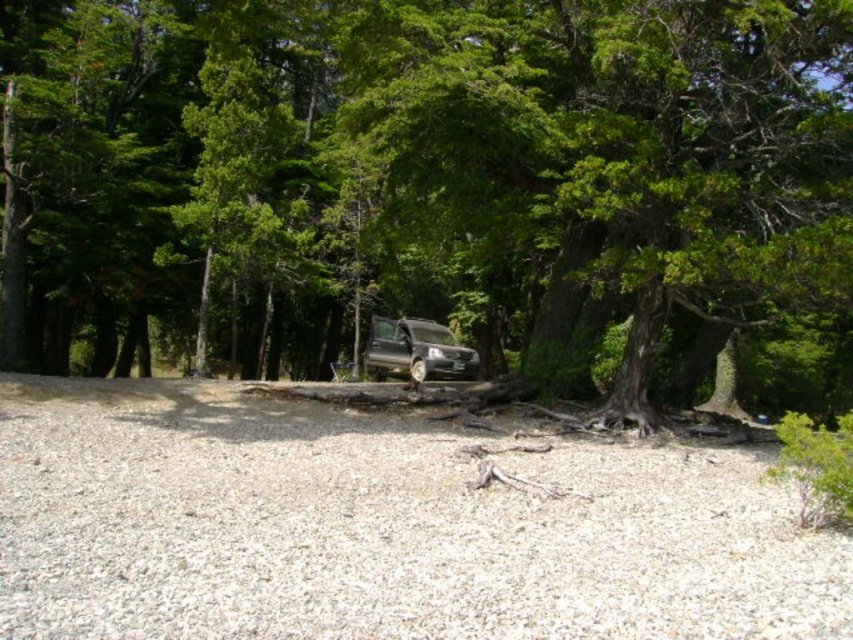
Question: Which of the following is the closest to the observer?

Choices:
 (A) coord(630,531)
 (B) coord(450,349)

Answer: (A)

Question: Which object is closer to the camera taking this photo?

Choices:
 (A) metallic silver van at center
 (B) gray gravel at center

Answer: (B)

Question: Among these points, which one is farthest from the camera?

Choices:
 (A) (47, 630)
 (B) (444, 339)
 (C) (480, 364)

Answer: (C)

Question: In this image, where is green leafy tree at center located relative to metallic silver van at center?

Choices:
 (A) right
 (B) left

Answer: (B)

Question: Does gray gravel at center have a lesser width compared to metallic silver van at center?

Choices:
 (A) yes
 (B) no

Answer: (B)

Question: Can you confirm if gray gravel at center is smaller than metallic silver van at center?

Choices:
 (A) yes
 (B) no

Answer: (B)